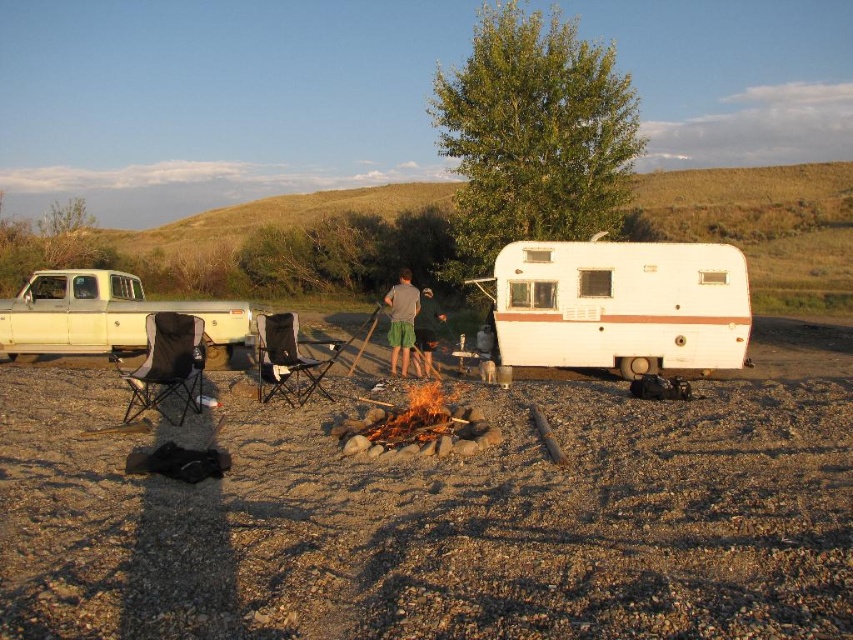
Can you confirm if white matte camper at center is thinner than dark gray fabric pants at center?

No, white matte camper at center is not thinner than dark gray fabric pants at center.

Is point (698, 291) more distant than point (427, 296)?

No, (698, 291) is in front of (427, 296).

Find the location of a particular element. The image size is (853, 640). white matte camper at center is located at coordinates (621, 305).

Which is above, dirt gravel at center or black mesh chair at lower left?

black mesh chair at lower left is above.

At what (x,y) coordinates should I click in order to perform the action: click on dirt gravel at center. Please return your answer as a coordinate pair (x, y). The height and width of the screenshot is (640, 853). Looking at the image, I should click on (437, 524).

Can you confirm if black mesh chair at lower left is positioned to the left of black fabric chair at center?

Yes, black mesh chair at lower left is to the left of black fabric chair at center.

This screenshot has width=853, height=640. Describe the element at coordinates (167, 365) in the screenshot. I see `black mesh chair at lower left` at that location.

In order to click on black mesh chair at lower left in this screenshot , I will do `click(167, 365)`.

Where is `black mesh chair at lower left`? The height and width of the screenshot is (640, 853). black mesh chair at lower left is located at coordinates (167, 365).